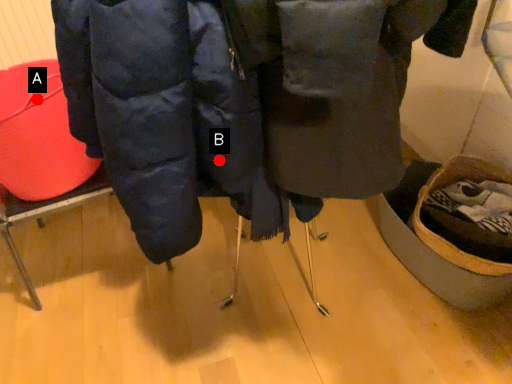
Question: Two points are circled on the image, labeled by A and B beside each circle. Which of the following is the farthest from the observer?

Choices:
 (A) A is further
 (B) B is further

Answer: (A)